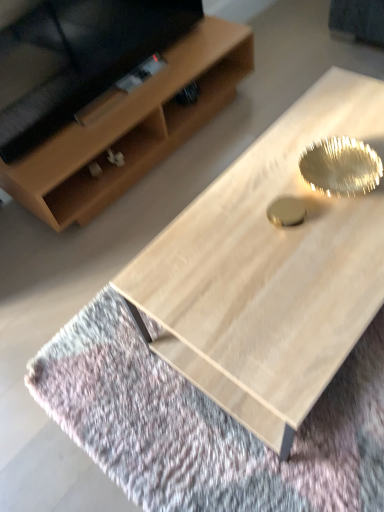
The height and width of the screenshot is (512, 384). Identify the location of free space that is to the left of light wood coffee table at center. (95, 345).